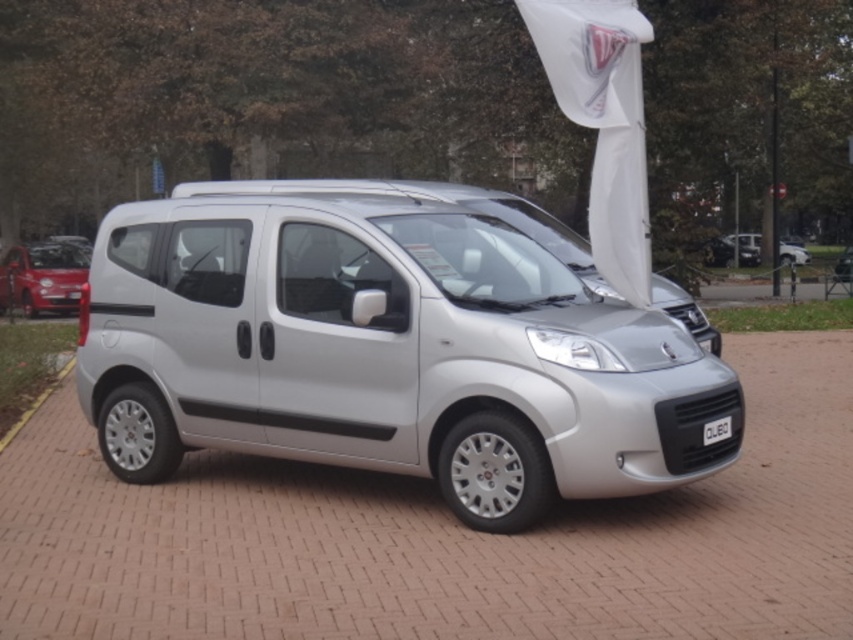
From the picture: Who is positioned more to the right, matte red car at left or satin silver van at right?

Positioned to the right is satin silver van at right.

Between point (16, 276) and point (746, 241), which one is positioned in front?

Point (16, 276) is in front.

I want to click on matte red car at left, so click(42, 276).

In the scene shown: Can you confirm if satin silver minivan at center is bigger than black plastic license plate at front?

Indeed, satin silver minivan at center has a larger size compared to black plastic license plate at front.

Does point (488, 289) lie behind point (712, 422)?

Yes, point (488, 289) is behind point (712, 422).

Does point (704, 476) come behind point (724, 420)?

No.

I want to click on satin silver minivan at center, so click(x=386, y=353).

Measure the distance between satin silver minivan at center and camera.

The distance of satin silver minivan at center from camera is 4.81 meters.

Does satin silver minivan at center have a greater width compared to matte red car at left?

Yes, satin silver minivan at center is wider than matte red car at left.

The width and height of the screenshot is (853, 640). What do you see at coordinates (386, 353) in the screenshot? I see `satin silver minivan at center` at bounding box center [386, 353].

Locate an element on the screen. satin silver minivan at center is located at coordinates (386, 353).